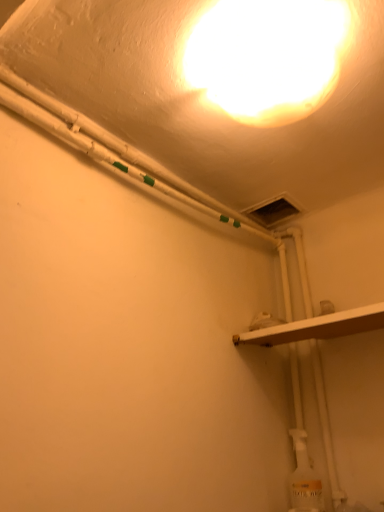
Question: Based on their positions, is white glossy light fixture at upper center located to the left or right of white matte shelf at lower right?

Choices:
 (A) right
 (B) left

Answer: (B)

Question: From a real-world perspective, is white glossy light fixture at upper center physically located above or below white matte shelf at lower right?

Choices:
 (A) below
 (B) above

Answer: (B)

Question: In terms of height, does white glossy light fixture at upper center look taller or shorter compared to white matte shelf at lower right?

Choices:
 (A) tall
 (B) short

Answer: (A)

Question: Based on their positions, is white matte shelf at lower right located to the left or right of white glossy light fixture at upper center?

Choices:
 (A) right
 (B) left

Answer: (A)

Question: Looking at the image, does white matte shelf at lower right seem bigger or smaller compared to white glossy light fixture at upper center?

Choices:
 (A) small
 (B) big

Answer: (A)

Question: In terms of height, does white matte shelf at lower right look taller or shorter compared to white glossy light fixture at upper center?

Choices:
 (A) short
 (B) tall

Answer: (A)

Question: Does point (269, 331) appear closer or farther from the camera than point (241, 37)?

Choices:
 (A) closer
 (B) farther

Answer: (B)